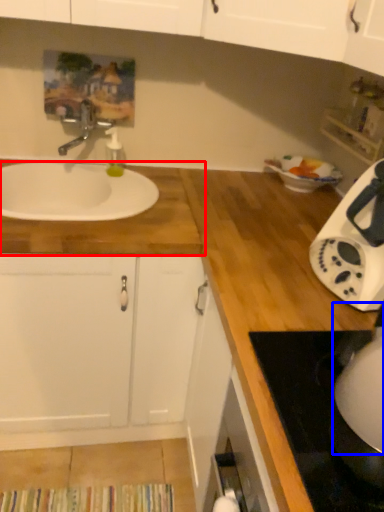
Question: Which object is closer to the camera taking this photo, countertop (highlighted by a red box) or appliance (highlighted by a blue box)?

Choices:
 (A) countertop
 (B) appliance

Answer: (B)